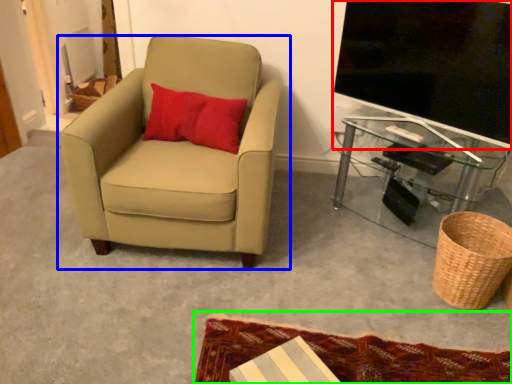
Question: Which is nearer to the television (highlighted by a red box)? chair (highlighted by a blue box) or mat (highlighted by a green box).

Choices:
 (A) chair
 (B) mat

Answer: (A)